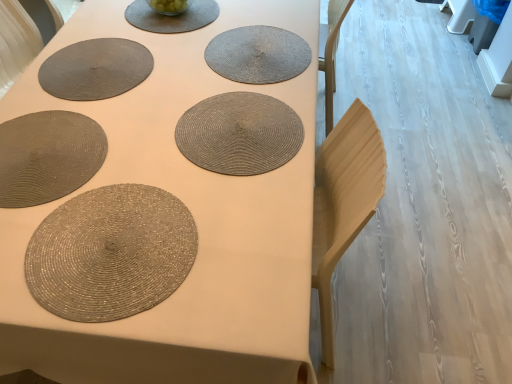
Find the location of a particular element. free space that is in between rattan placemat at center, the second coaster positioned from the back, and matte gray placemat at upper center is located at coordinates (201, 62).